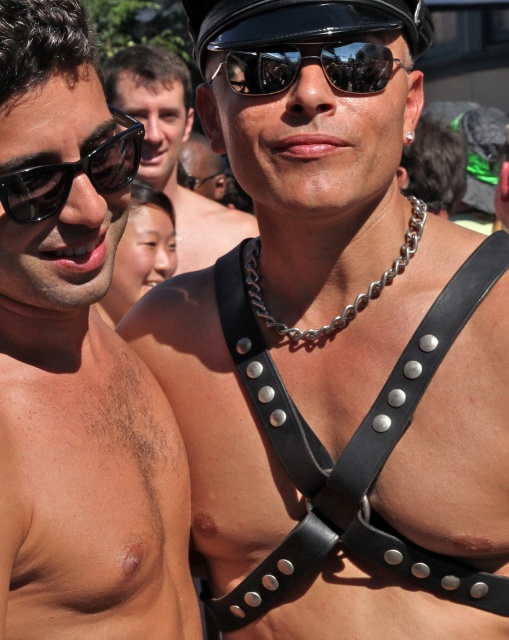
Does point (243, 76) come closer to viewer compared to point (39, 211)?

That is False.

Between black reflective sunglasses at center and black plastic sunglasses at left, which one has less height?

With less height is black reflective sunglasses at center.

Which is behind, point (404, 68) or point (35, 168)?

The point (404, 68) is behind.

The image size is (509, 640). Identify the location of black reflective sunglasses at center. (305, 58).

Which is in front, point (214, 202) or point (262, 52)?

Point (262, 52) is in front.

Who is more distant from viewer, (173, 134) or (330, 51)?

Positioned behind is point (173, 134).

This screenshot has width=509, height=640. Find the location of `leather harness at center`. leather harness at center is located at coordinates (172, 148).

The image size is (509, 640). I want to click on matte black sunglasses at left, so click(x=76, y=364).

Does point (39, 90) come behind point (354, 76)?

No.

Is point (167, 410) positioned in front of point (347, 49)?

No, it is behind (347, 49).

Where is `matte black sunglasses at left`? Image resolution: width=509 pixels, height=640 pixels. matte black sunglasses at left is located at coordinates (76, 364).